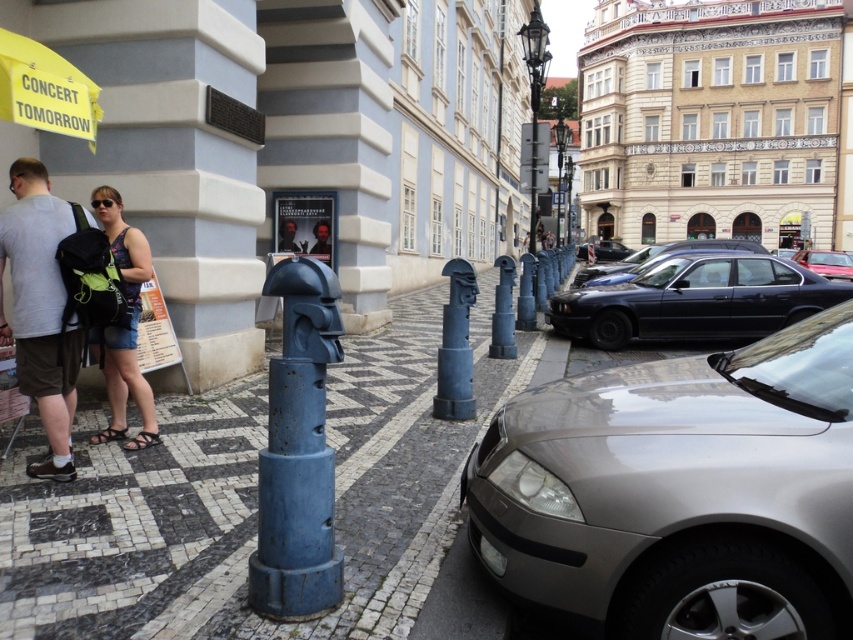
Question: Does blue painted metal bollard at center appear under matte gray backpack at left?

Choices:
 (A) yes
 (B) no

Answer: (A)

Question: Which object is positioned closest to the matte black tank top at center?

Choices:
 (A) blue painted metal bollard at center
 (B) yellow fabric umbrella at upper left
 (C) black glossy sedan at center
 (D) metallic red car at right

Answer: (B)

Question: Among these objects, which one is farthest from the camera?

Choices:
 (A) matte gray backpack at left
 (B) metallic red car at right

Answer: (B)

Question: Which point is closer to the camera?

Choices:
 (A) (825, 252)
 (B) (596, 314)

Answer: (B)

Question: Is metallic silver car at center behind yellow fabric umbrella at upper left?

Choices:
 (A) yes
 (B) no

Answer: (B)

Question: Can you confirm if metallic silver car at center is positioned to the right of matte gray backpack at left?

Choices:
 (A) yes
 (B) no

Answer: (A)